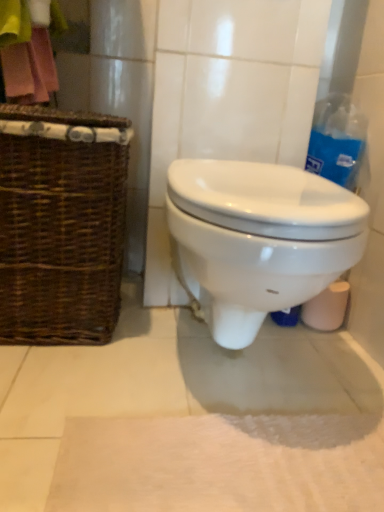
You are a GUI agent. You are given a task and a screenshot of the screen. Output one action in this format:
    pyautogui.click(x=<x>, y=<y>)
    Task: Click on the vacant space situated on the left part of white soft bath mat at lower center
    This screenshot has width=384, height=512.
    Given the screenshot: What is the action you would take?
    pyautogui.click(x=70, y=395)